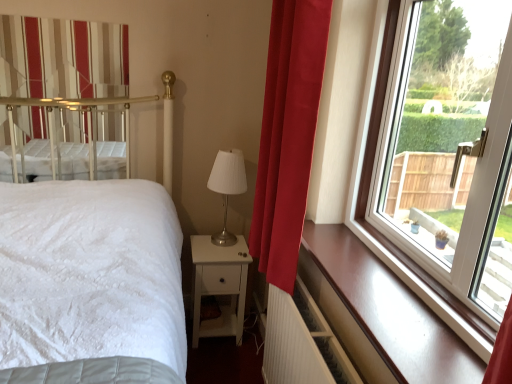
Question: Is velvet red curtain at right, the first curtain when ordered from front to back, in front of or behind white ribbed radiator at lower right in the image?

Choices:
 (A) front
 (B) behind

Answer: (B)

Question: Considering the positions of velvet red curtain at right, the first curtain when ordered from front to back, and white ribbed radiator at lower right in the image, is velvet red curtain at right, the first curtain when ordered from front to back, taller or shorter than white ribbed radiator at lower right?

Choices:
 (A) tall
 (B) short

Answer: (A)

Question: Based on their relative distances, which object is farther from the velvet red curtain at right, which is the 2th curtain from back to front?

Choices:
 (A) white ribbed radiator at lower right
 (B) transparent glass window at right
 (C) metallic silver table lamp at center
 (D) glossy wood window sill at right
 (E) striped fabric curtain at upper left, which is the second curtain in front-to-back order

Answer: (E)

Question: Based on their relative distances, which object is nearer to the metallic silver table lamp at center?

Choices:
 (A) velvet red curtain at right, the first curtain when ordered from front to back
 (B) transparent glass window at right
 (C) white ribbed radiator at lower right
 (D) glossy wood window sill at right
 (E) white matte nightstand at lower center

Answer: (E)